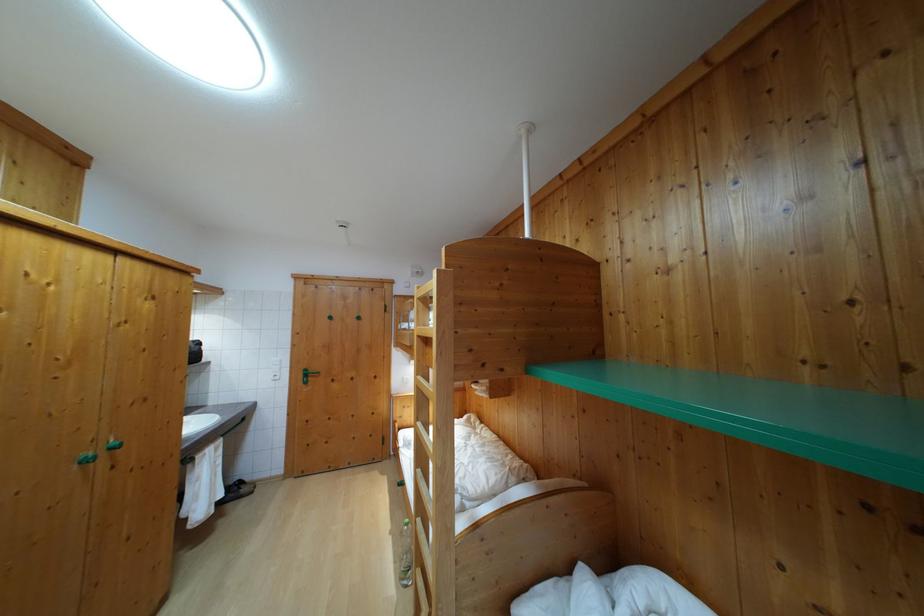
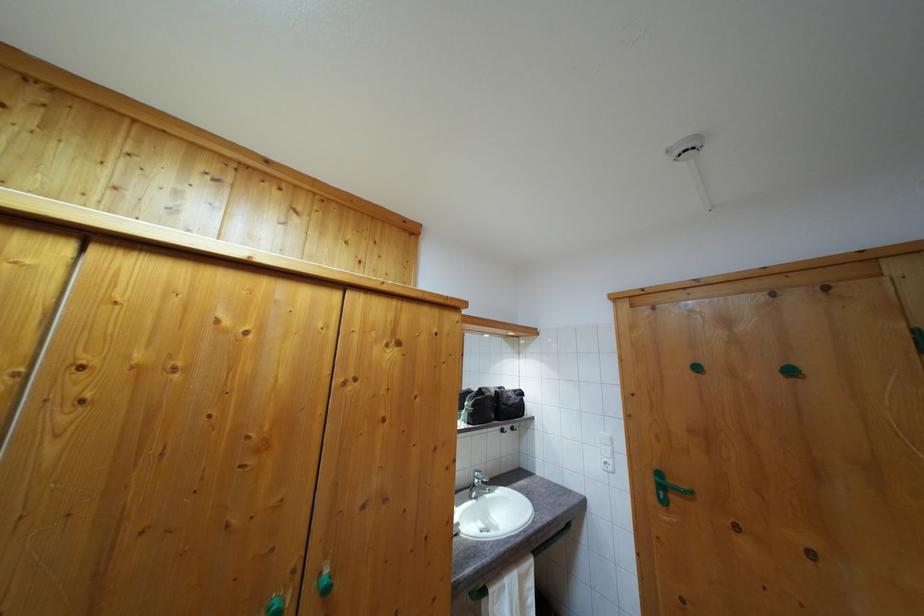
The point at [310,383] is marked in the first image. Where is the corresponding point in the second image?

(664, 493)